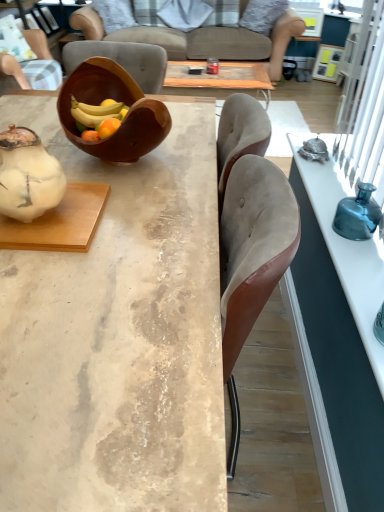
Where is `vacant space situated above marble table at center, which ranks as the first desk in left-to-right order (from a real-world perspective)`? Image resolution: width=384 pixels, height=512 pixels. vacant space situated above marble table at center, which ranks as the first desk in left-to-right order (from a real-world perspective) is located at coordinates (115, 217).